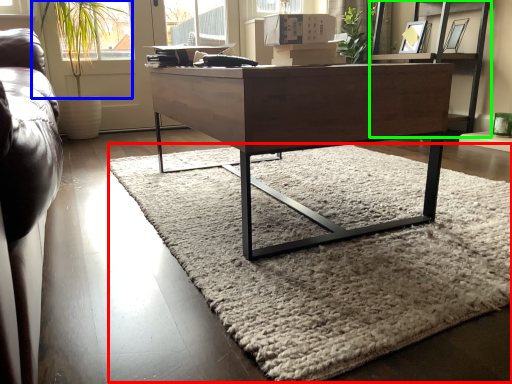
Question: Which object is positioned closest to mat (highlighted by a red box)? Select from plant (highlighted by a blue box) and shelf (highlighted by a green box).

Choices:
 (A) plant
 (B) shelf

Answer: (B)